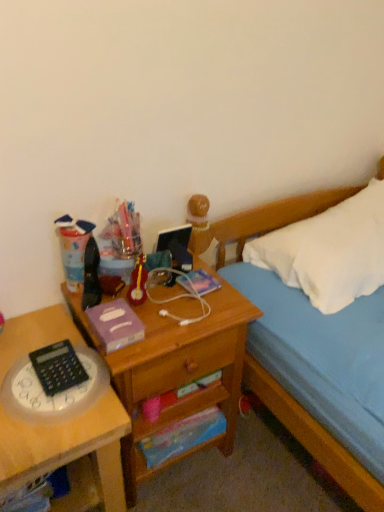
Locate an element on the screen. The image size is (384, 512). vacant region to the right of purple matte paper at center, placed as the second paperback book when sorted from bottom to top is located at coordinates (167, 329).